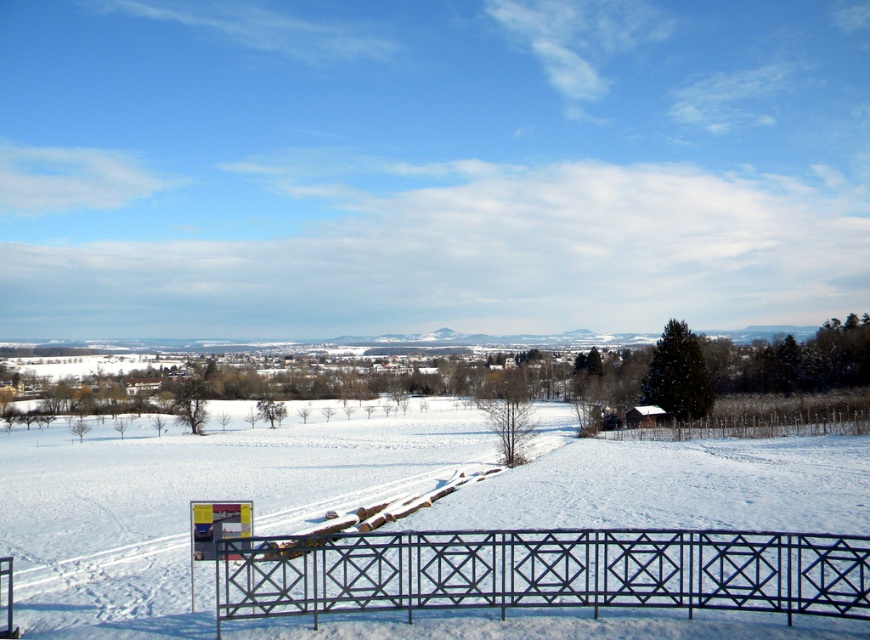
In the scene shown: You are planning to build a snowman using the white powdery snow at center and need to ensure there is enough space between it and the black metal fence at lower center. Can you confirm if the snow area is wide enough to accommodate a snowman without touching the fence?

The white powdery snow at center has a larger width than the black metal fence at lower center, so there is sufficient space to build a snowman without touching the fence.

From the picture: You are an observer standing in the winter landscape. You see the white powdery snow at center and the black metal fence at lower center. Which object is closer to the ground?

The white powdery snow at center is closer to the ground because it is located below the black metal fence at lower center.